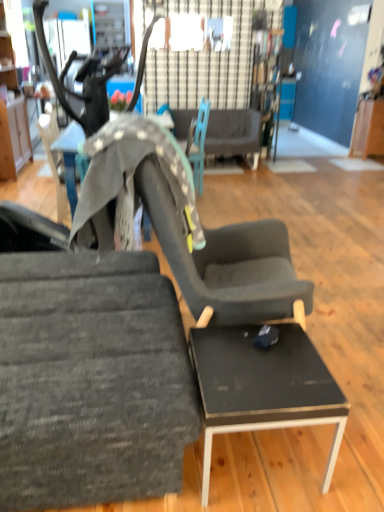
Question: Considering the positions of black glossy table at lower right and textured gray fabric chair at left, acting as the second chair starting from the back, in the image, is black glossy table at lower right bigger or smaller than textured gray fabric chair at left, acting as the second chair starting from the back,?

Choices:
 (A) small
 (B) big

Answer: (A)

Question: Visually, is black glossy table at lower right positioned to the left or to the right of textured gray fabric chair at left, acting as the second chair starting from the back?

Choices:
 (A) right
 (B) left

Answer: (A)

Question: Based on their relative distances, which object is nearer to the wooden cabinet at left?

Choices:
 (A) black glossy table at lower right
 (B) teal fabric chair at center, the second chair in the front-to-back sequence
 (C) textured gray fabric chair at left, the 2th chair positioned from the top
 (D) dark gray fabric couch at center
 (E) black glossy table at center

Answer: (E)

Question: Considering the real-world distances, which object is closest to the teal fabric chair at center, marked as the second chair in a bottom-to-top arrangement?

Choices:
 (A) textured gray fabric chair at left, the 1th chair from the bottom
 (B) dark gray fabric couch at center
 (C) wooden cabinet at left
 (D) black glossy table at lower right
 (E) black glossy table at center

Answer: (E)